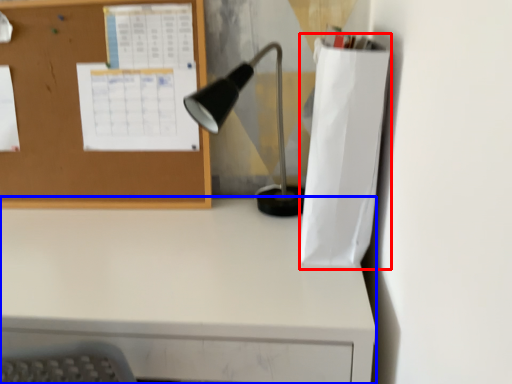
Question: Among these objects, which one is farthest to the camera, paper bag (highlighted by a red box) or desk (highlighted by a blue box)?

Choices:
 (A) paper bag
 (B) desk

Answer: (A)